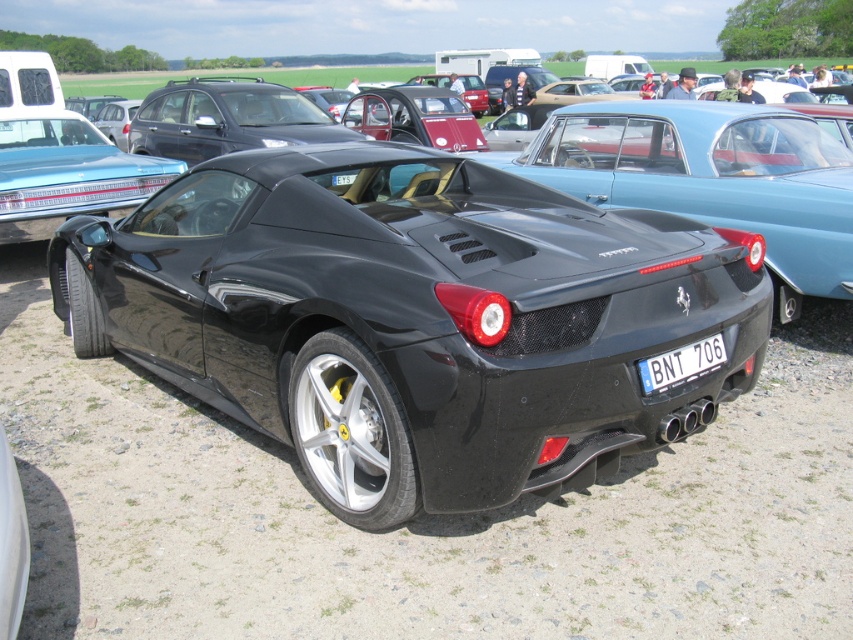
Which is behind, point (381, 152) or point (675, 368)?

The point (381, 152) is behind.

Between shiny black sports car at center and white plastic license plate at center, which one appears on the left side from the viewer's perspective?

shiny black sports car at center

Where is `shiny black sports car at center`? shiny black sports car at center is located at coordinates (415, 317).